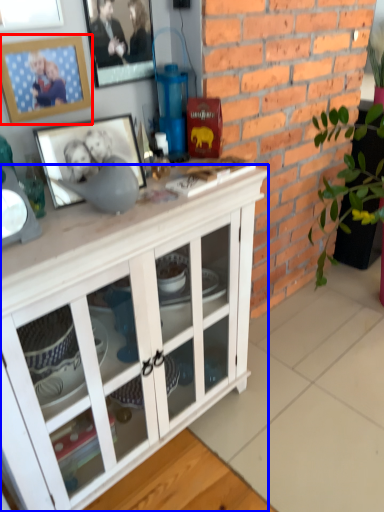
Question: Which point is further to the camera, picture frame (highlighted by a red box) or cabinetry (highlighted by a blue box)?

Choices:
 (A) picture frame
 (B) cabinetry

Answer: (A)